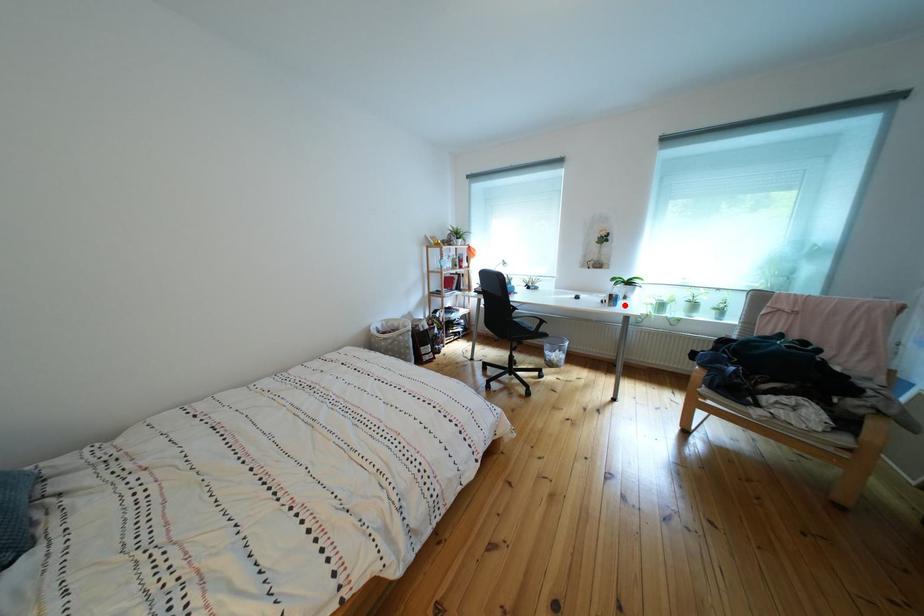
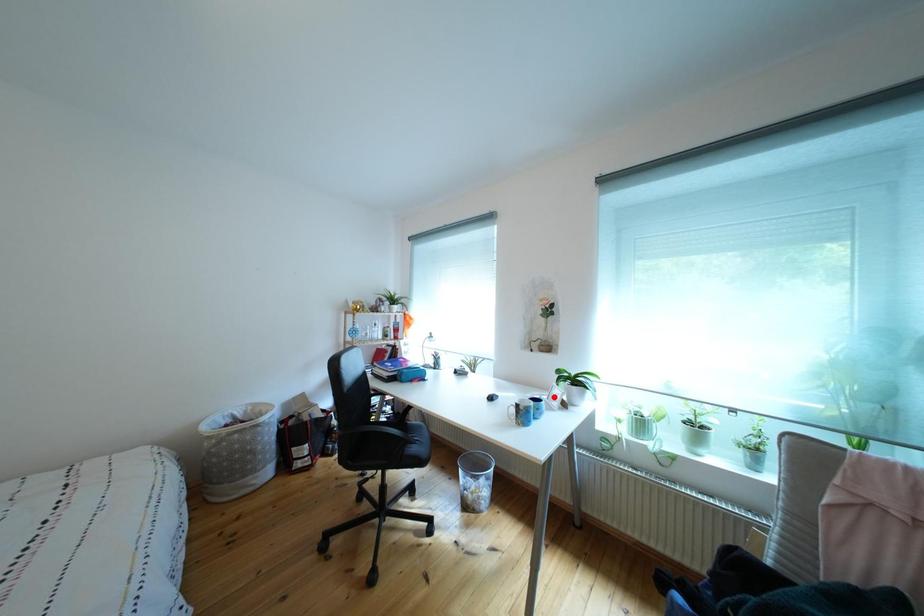
I am providing you with two images of the same scene from different viewpoints. A red point is marked on the first image and another point is marked on the second image. Does the point marked in image1 correspond to the same location as the one in image2?

No